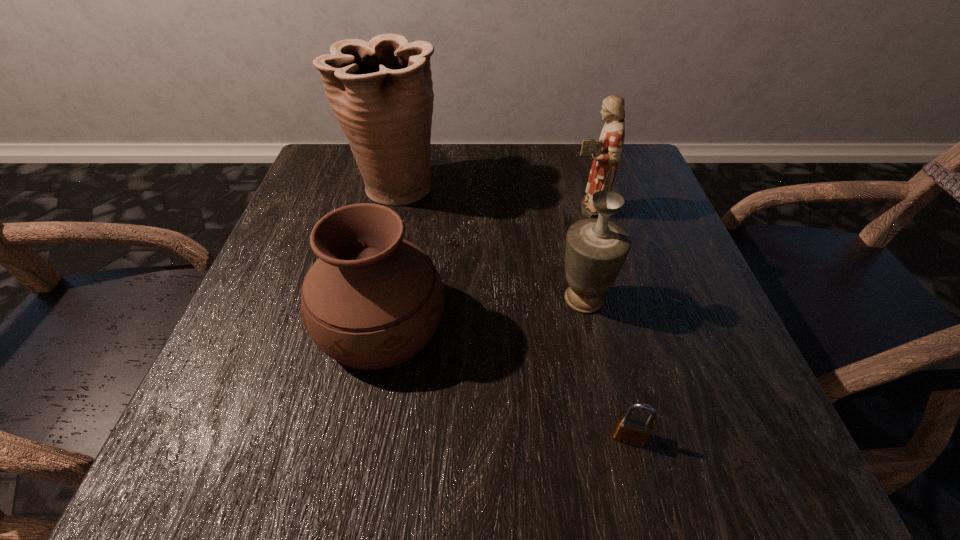
At what (x,y) coordinates should I click in order to perform the action: click on free region located on the right of the rightmost urn. Please return your answer as a coordinate pair (x, y). Image resolution: width=960 pixels, height=540 pixels. Looking at the image, I should click on (692, 299).

Image resolution: width=960 pixels, height=540 pixels. I want to click on vacant space located 0.190m on the back of the padlock, so click(x=600, y=316).

The height and width of the screenshot is (540, 960). Identify the location of urn that is at the far edge. (381, 92).

Locate an element on the screen. The width and height of the screenshot is (960, 540). figurine present at the far edge is located at coordinates (606, 152).

Image resolution: width=960 pixels, height=540 pixels. I want to click on object present at the near edge, so click(633, 429).

Where is `object at the right edge`? This screenshot has width=960, height=540. object at the right edge is located at coordinates (606, 152).

Identify the location of object that is at the far left corner. (381, 92).

Find the location of a particular element. The width and height of the screenshot is (960, 540). object at the far right corner is located at coordinates (606, 152).

Locate an element on the screen. The width and height of the screenshot is (960, 540). free region at the far edge of the desktop is located at coordinates (477, 148).

This screenshot has height=540, width=960. Identify the location of free space at the near edge of the desktop. (516, 435).